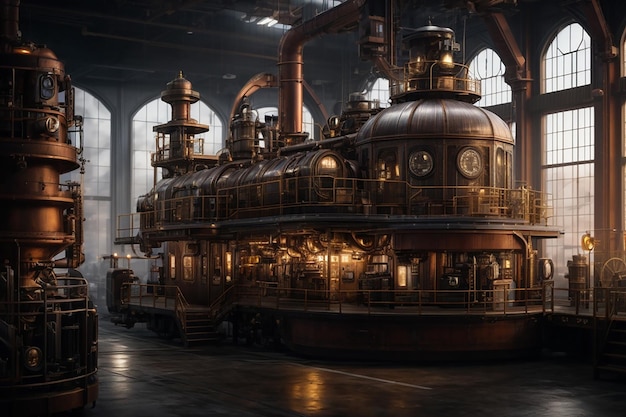
You are a GUI agent. You are given a task and a screenshot of the screen. Output one action in this format:
    pyautogui.click(x=<x>, y=<y>)
    Task: Click on the stairs
    This screenshot has width=626, height=417.
    Given the screenshot: What is the action you would take?
    pyautogui.click(x=200, y=329)